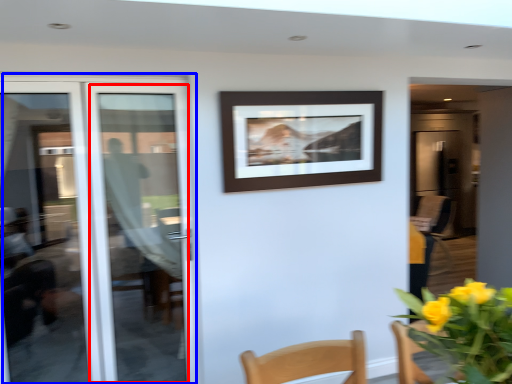
Question: Which point is closer to the camera, door (highlighted by a red box) or door (highlighted by a blue box)?

Choices:
 (A) door
 (B) door

Answer: (B)